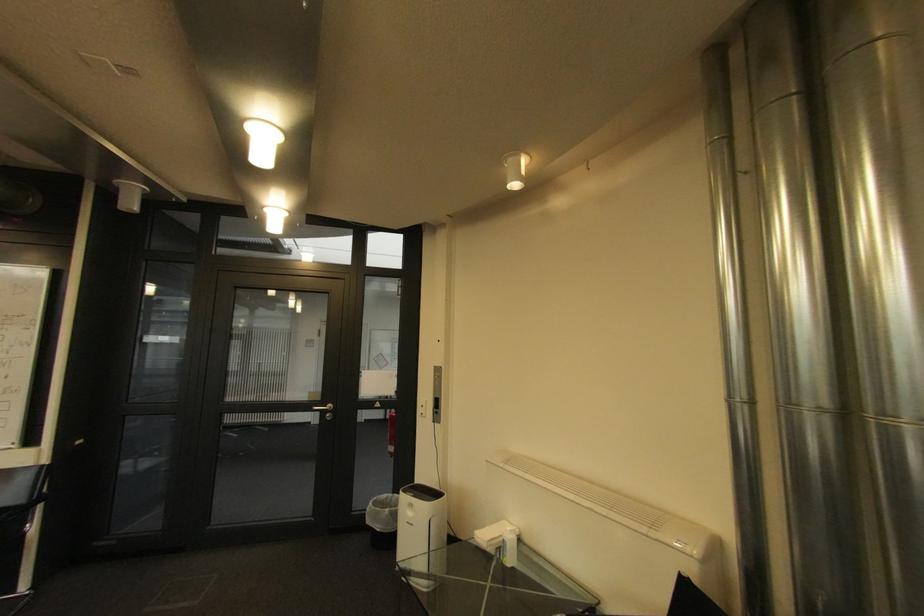
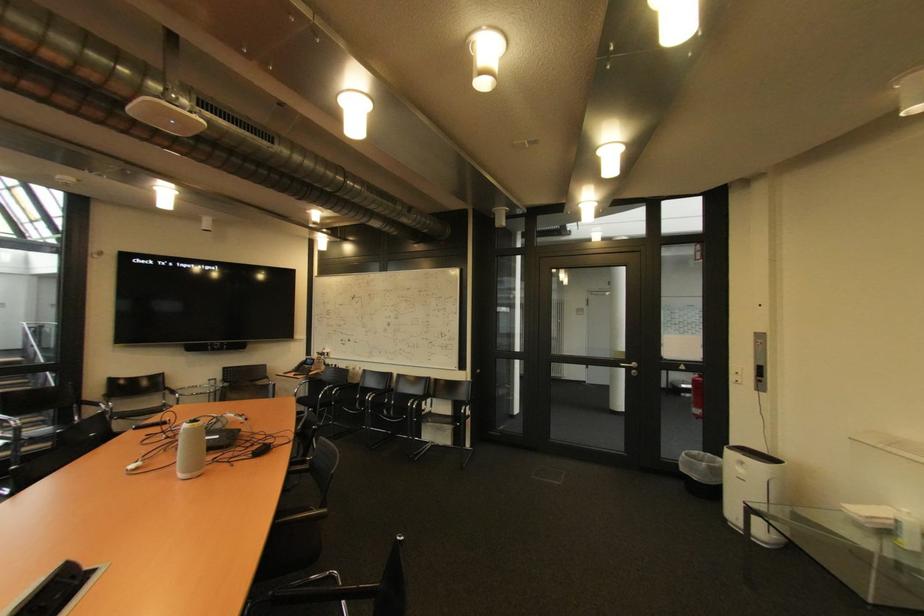
Question: The camera is either moving clockwise (left) or counter-clockwise (right) around the object. The first image is from the beginning of the video and the second image is from the end. Is the camera moving left or right when shooting the video?

Choices:
 (A) Left
 (B) Right

Answer: (B)